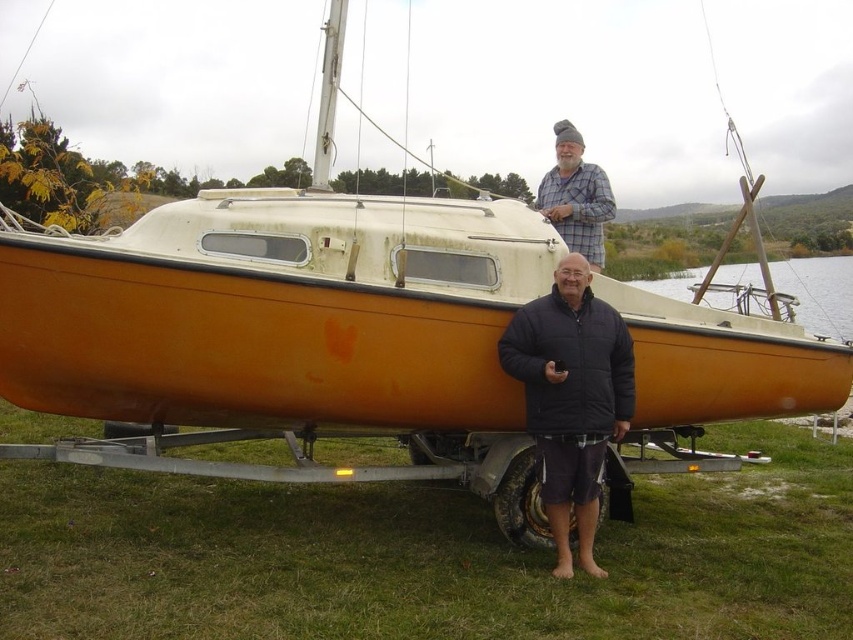
You are standing at the viewing position and want to hand the black fuzzy jacket at center to someone who is 16 feet away from you. Can you reach them directly without moving?

The black fuzzy jacket at center is 15.52 feet from viewer, so yes, you can reach them directly without moving since the distance is within 16 feet.

You are a fashion designer observing two people near a sailboat. You notice the black fuzzy jacket at center and the plaid fabric shirt at upper center. Which clothing item is smaller in size?

The black fuzzy jacket at center has a smaller size compared to the plaid fabric shirt at upper center.